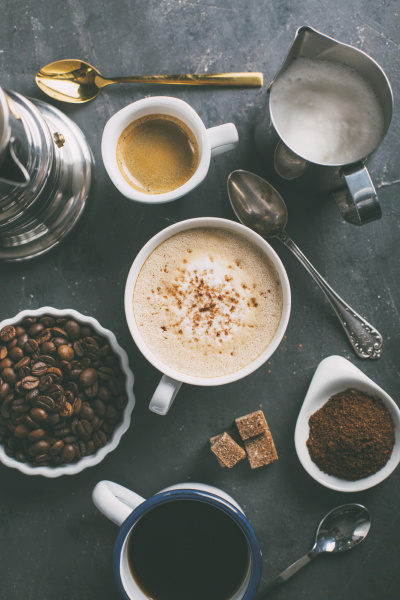
Find the location of `spoons ( and spoon reflection)`. spoons ( and spoon reflection) is located at coordinates (328, 533), (237, 181), (93, 82), (290, 162).